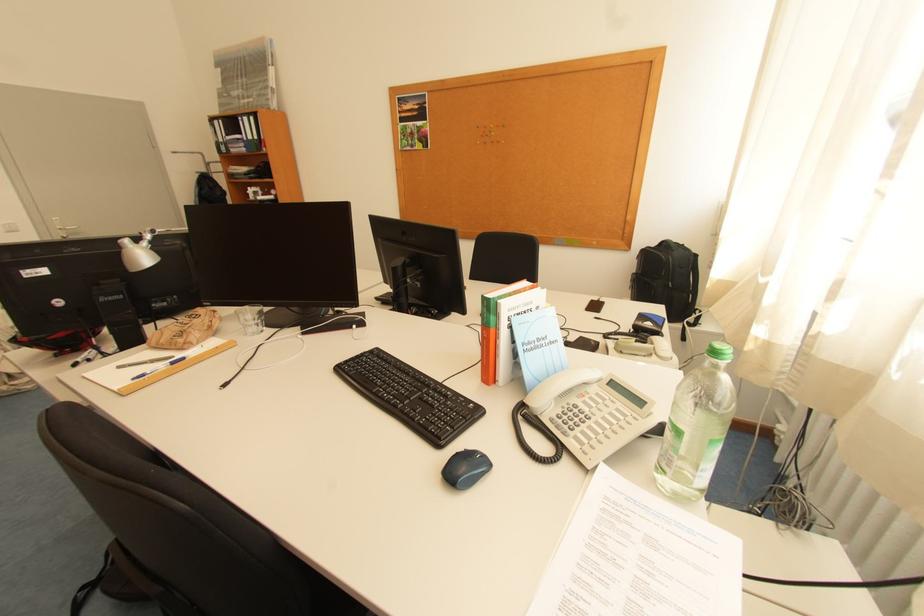
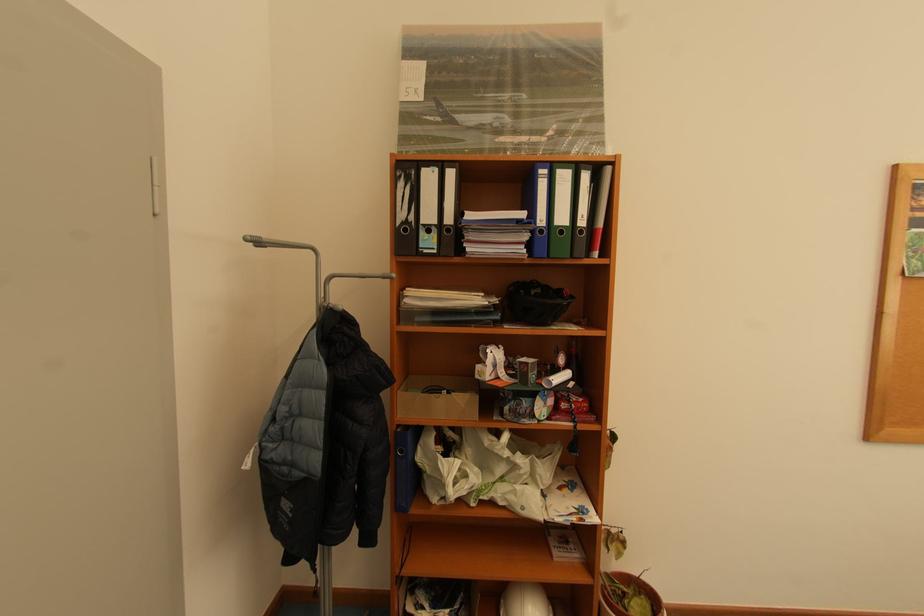
Find the pixel in the second image that matches pixel 248 120 in the first image.

(552, 172)